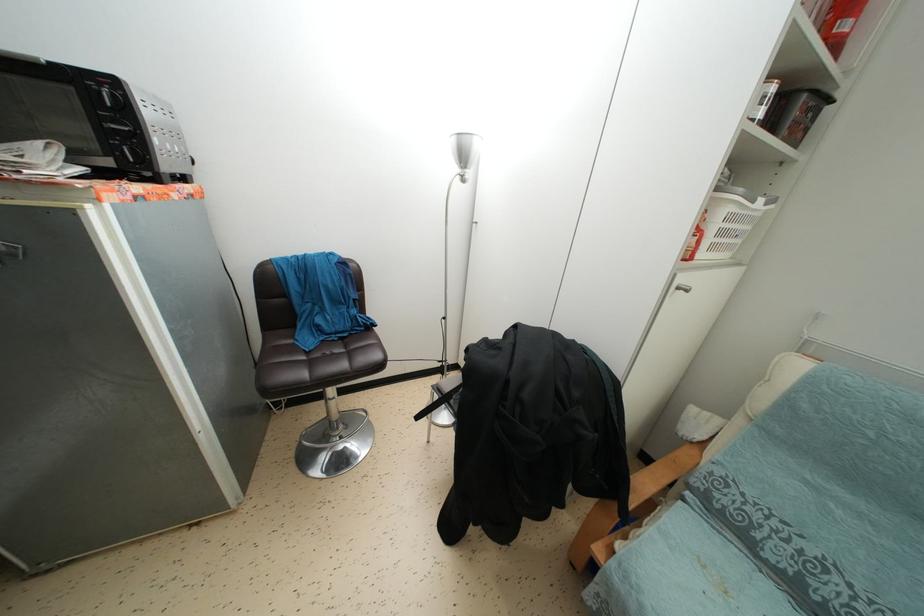
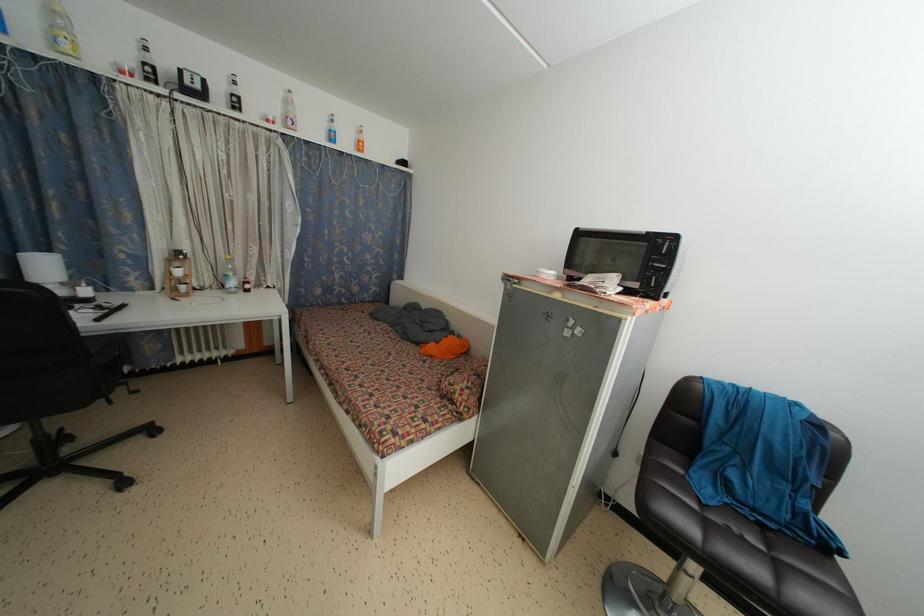
The point at (143,148) is marked in the first image. Where is the corresponding point in the second image?

(669, 280)